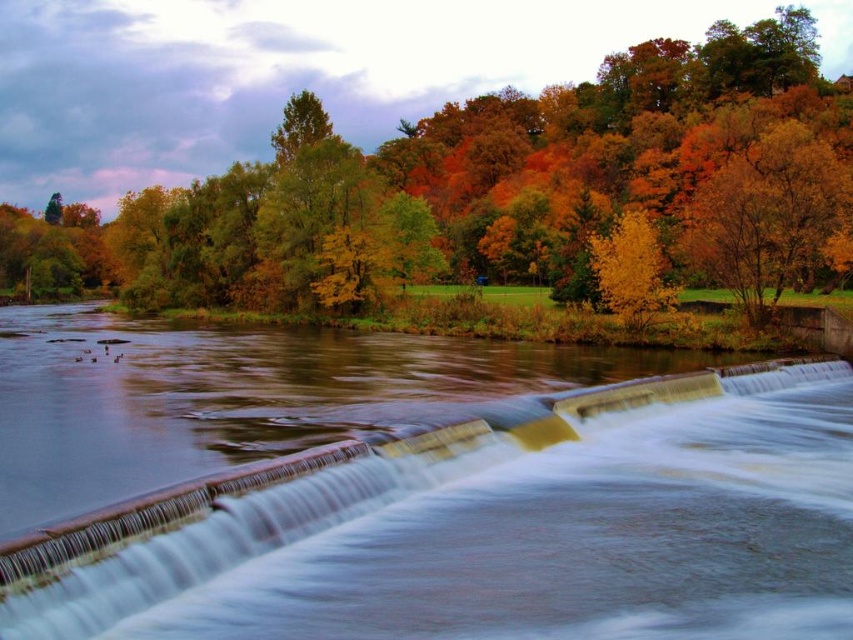
Who is lower down, yellow-green leaves at upper center or golden yellow leaves at center right?

Positioned lower is golden yellow leaves at center right.

Between yellow-green leaves at upper center and golden yellow leaves at center right, which one is positioned higher?

yellow-green leaves at upper center

This screenshot has height=640, width=853. Describe the element at coordinates (502, 189) in the screenshot. I see `yellow-green leaves at upper center` at that location.

You are a GUI agent. You are given a task and a screenshot of the screen. Output one action in this format:
    pyautogui.click(x=<x>, y=<y>)
    Task: Click on the yellow-green leaves at upper center
    This screenshot has width=853, height=640.
    Given the screenshot: What is the action you would take?
    pyautogui.click(x=502, y=189)

Who is shorter, white smooth waterfall at lower center or yellow-green leaves at upper center?

white smooth waterfall at lower center is shorter.

What do you see at coordinates (500, 531) in the screenshot?
I see `white smooth waterfall at lower center` at bounding box center [500, 531].

You are a GUI agent. You are given a task and a screenshot of the screen. Output one action in this format:
    pyautogui.click(x=<x>, y=<y>)
    Task: Click on the white smooth waterfall at lower center
    The width and height of the screenshot is (853, 640).
    Given the screenshot: What is the action you would take?
    pyautogui.click(x=500, y=531)

This screenshot has height=640, width=853. I want to click on white smooth waterfall at lower center, so tap(500, 531).

Can you confirm if white smooth waterfall at lower center is bigger than golden yellow leaves at center right?

No.

Does white smooth waterfall at lower center lie behind golden yellow leaves at center right?

No, white smooth waterfall at lower center is in front of golden yellow leaves at center right.

Does point (136, 524) come farther from viewer compared to point (666, 308)?

That is False.

Locate an element on the screen. This screenshot has width=853, height=640. white smooth waterfall at lower center is located at coordinates (500, 531).